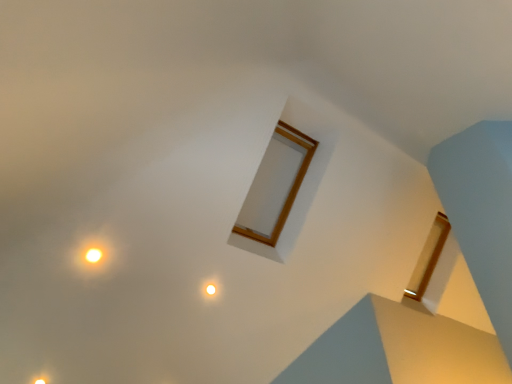
Question: Is matte yellow light at lower left, which appears as the second light when viewed from the front, at the back of matte white light at center, arranged as the 2th light when viewed from the top?

Choices:
 (A) no
 (B) yes

Answer: (A)

Question: From a real-world perspective, is matte white light at center, the 1th light viewed from the back, located beneath matte yellow light at lower left, which appears as the second light when viewed from the front?

Choices:
 (A) yes
 (B) no

Answer: (B)

Question: Does matte white light at center, which is counted as the first light, starting from the right, appear on the right side of matte yellow light at lower left, the first light in the bottom-to-top sequence?

Choices:
 (A) no
 (B) yes

Answer: (B)

Question: Would you say matte white light at center, the third light positioned from the left, is a long distance from matte yellow light at lower left, which appears as the second light when viewed from the back?

Choices:
 (A) no
 (B) yes

Answer: (B)

Question: From the image's perspective, is matte white light at center, acting as the third light starting from the front, on matte yellow light at lower left, which appears as the second light when viewed from the front?

Choices:
 (A) no
 (B) yes

Answer: (B)

Question: Could you tell me if matte white light at center, the 2th light from the bottom, is turned towards matte yellow light at lower left, marked as the 1th light in a left-to-right arrangement?

Choices:
 (A) no
 (B) yes

Answer: (A)

Question: Is matte yellow light at lower left, marked as the 1th light in a left-to-right arrangement, positioned before matte white light at center, the 1th light viewed from the back?

Choices:
 (A) yes
 (B) no

Answer: (A)

Question: Can you confirm if matte yellow light at lower left, which is the 3th light from right to left, is wider than matte white light at center, the 1th light viewed from the back?

Choices:
 (A) no
 (B) yes

Answer: (B)

Question: Is matte yellow light at lower left, which is the 3th light from top to bottom, not near matte white light at center, the third light positioned from the left?

Choices:
 (A) yes
 (B) no

Answer: (A)

Question: Is matte yellow light at lower left, which appears as the second light when viewed from the front, shorter than matte white light at center, acting as the third light starting from the front?

Choices:
 (A) no
 (B) yes

Answer: (A)

Question: Is the depth of matte yellow light at lower left, which appears as the second light when viewed from the front, greater than that of matte white light at center, acting as the third light starting from the front?

Choices:
 (A) yes
 (B) no

Answer: (B)

Question: From a real-world perspective, is matte yellow light at lower left, which appears as the second light when viewed from the front, on matte white light at center, arranged as the 2th light when viewed from the top?

Choices:
 (A) yes
 (B) no

Answer: (B)

Question: Can you confirm if yellow matte light at upper left, positioned as the 3th light in bottom-to-top order, is wider than matte white light at center, the 1th light viewed from the back?

Choices:
 (A) yes
 (B) no

Answer: (A)